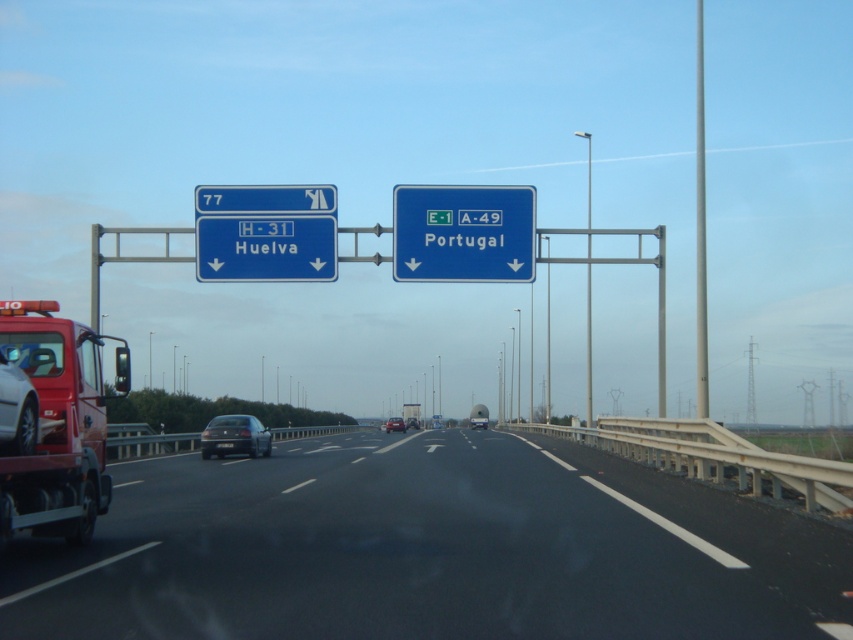
Between red matte fire truck at left and black plastic license plate at center, which one is positioned lower?

black plastic license plate at center is below.

Measure the distance from red matte fire truck at left to black plastic license plate at center.

The distance of red matte fire truck at left from black plastic license plate at center is 66.22 feet.

Between point (33, 356) and point (227, 445), which one is positioned behind?

The point (227, 445) is behind.

The image size is (853, 640). Identify the location of red matte fire truck at left. (57, 422).

Between black asphalt highway at center and red matte fire truck at left, which one is positioned lower?

black asphalt highway at center is lower down.

Who is shorter, black asphalt highway at center or red matte fire truck at left?

Standing shorter between the two is black asphalt highway at center.

Is point (648, 598) more distant than point (82, 326)?

No.

Where is `black asphalt highway at center`? black asphalt highway at center is located at coordinates (428, 548).

Can you confirm if blue metallic sign at center is shorter than blue metallic sign at upper center?

No.

Find the location of a particular element. The height and width of the screenshot is (640, 853). blue metallic sign at center is located at coordinates (463, 234).

Who is more distant from viewer, [413,186] or [299,228]?

Positioned behind is point [413,186].

The width and height of the screenshot is (853, 640). I want to click on blue metallic sign at center, so click(463, 234).